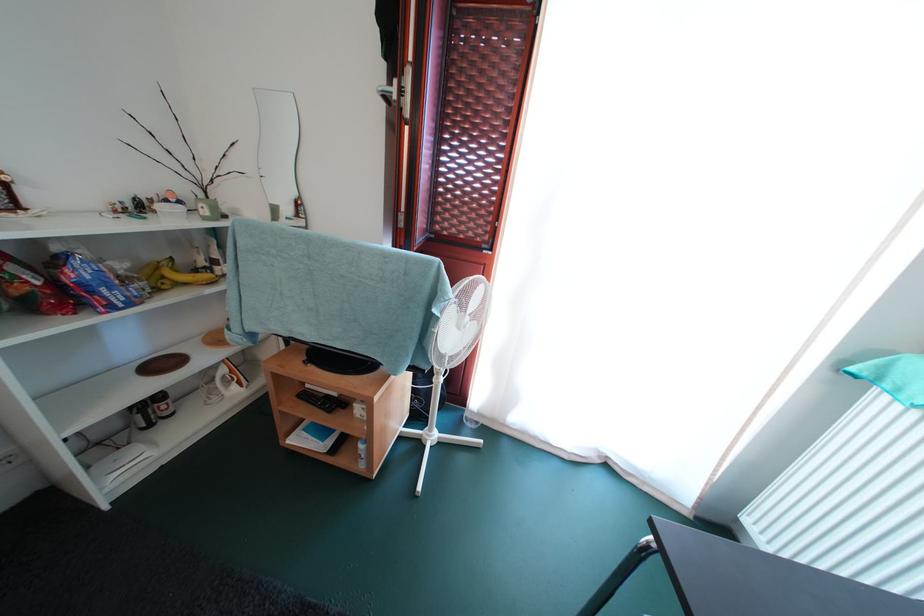
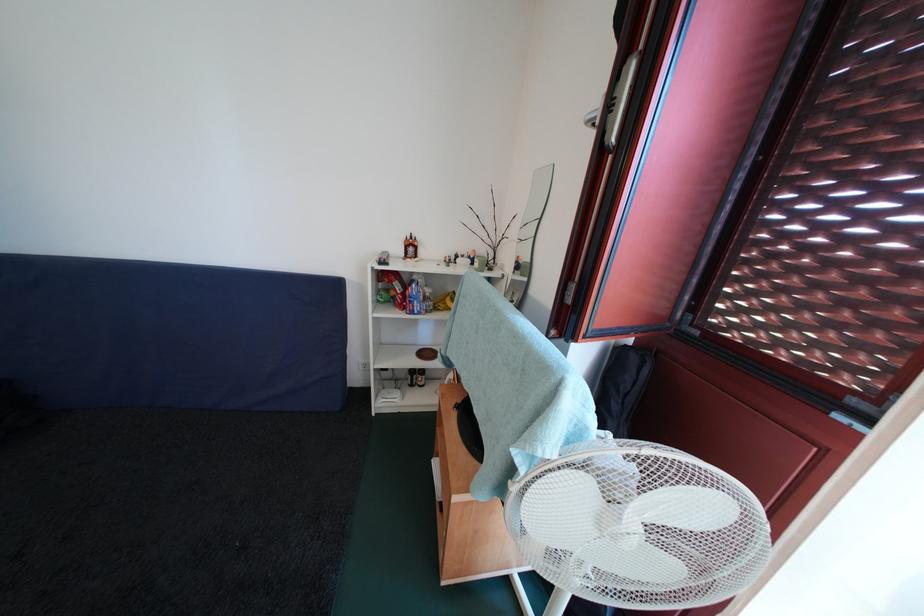
Locate, in the second image, the point that corresponds to [111,296] in the first image.

(422, 307)